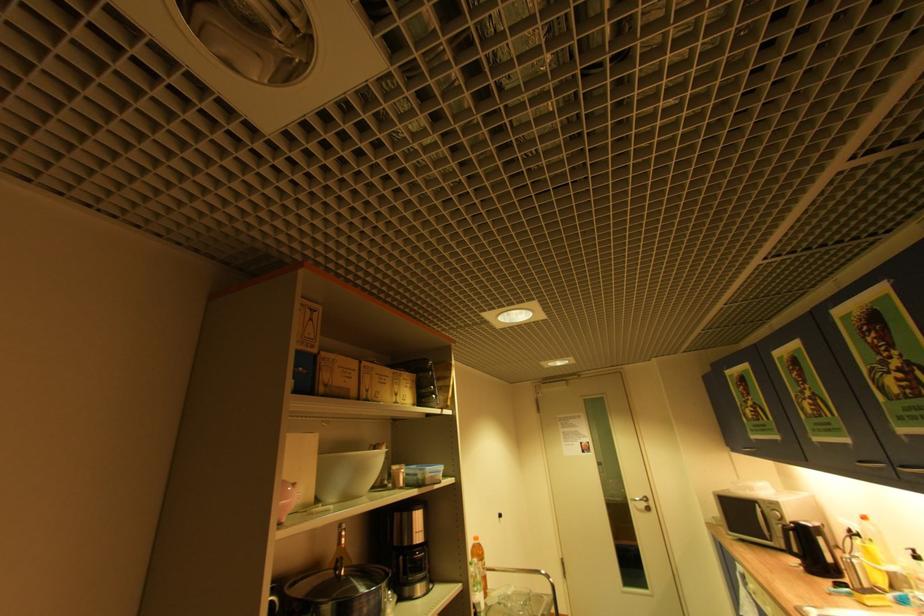
I want to click on large white bowl, so click(346, 475).